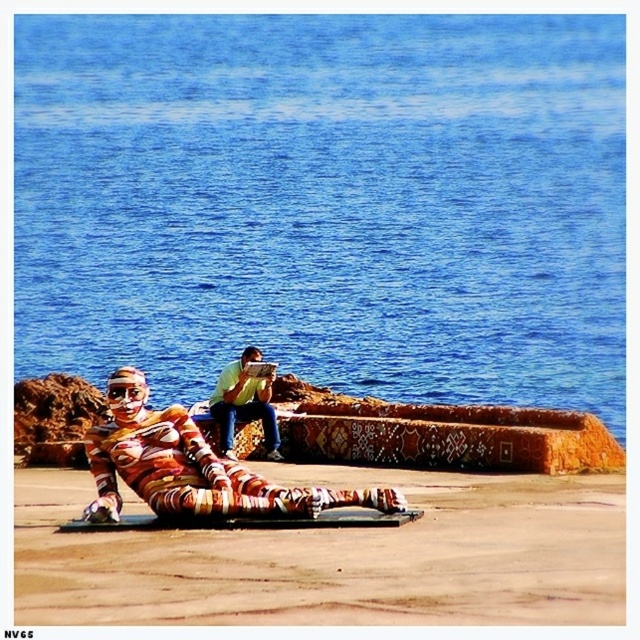
Measure the distance between smooth tan sand at lower center and camera.

A distance of 149.98 feet exists between smooth tan sand at lower center and camera.

This screenshot has width=640, height=640. What are the coordinates of `smooth tan sand at lower center` in the screenshot? It's located at (337, 557).

This screenshot has height=640, width=640. What do you see at coordinates (337, 557) in the screenshot?
I see `smooth tan sand at lower center` at bounding box center [337, 557].

Who is taller, smooth tan sand at lower center or yellow-green t-shirt at center?

With more height is yellow-green t-shirt at center.

Between point (227, 580) and point (241, 364), which one is positioned behind?

Positioned behind is point (241, 364).

Identify the location of smooth tan sand at lower center. (337, 557).

Is blue water at upper center wider than smooth tan sand at lower center?

Yes, blue water at upper center is wider than smooth tan sand at lower center.

Is blue water at upper center positioned before smooth tan sand at lower center?

No, blue water at upper center is further to the viewer.

What do you see at coordinates (324, 202) in the screenshot? The image size is (640, 640). I see `blue water at upper center` at bounding box center [324, 202].

I want to click on blue water at upper center, so click(324, 202).